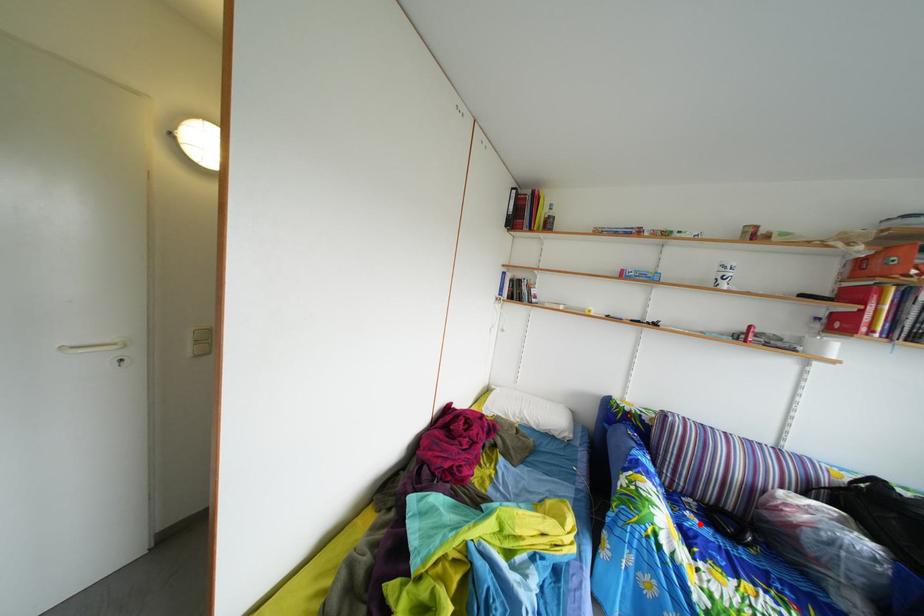
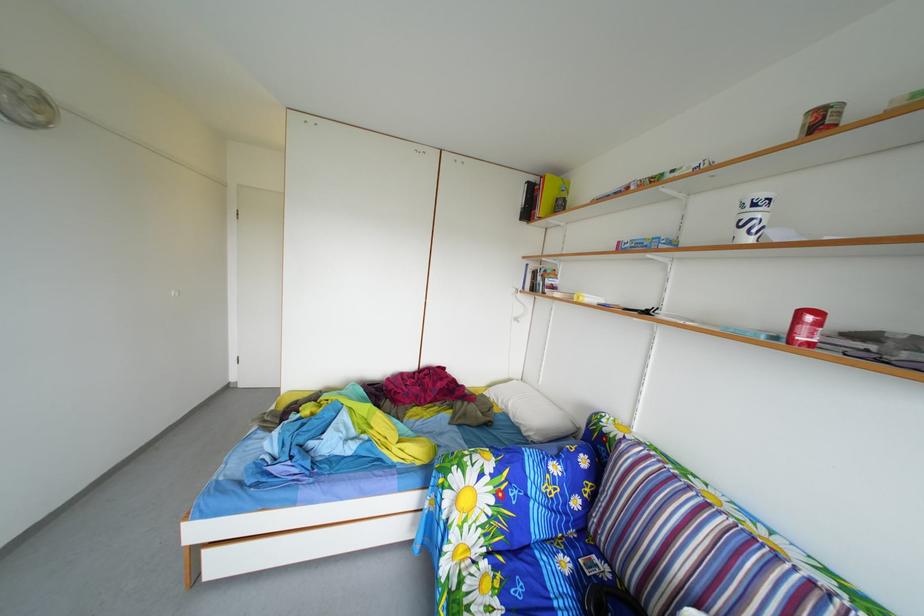
In the second image, find the point that corresponds to the highlighted location in the first image.

(576, 570)